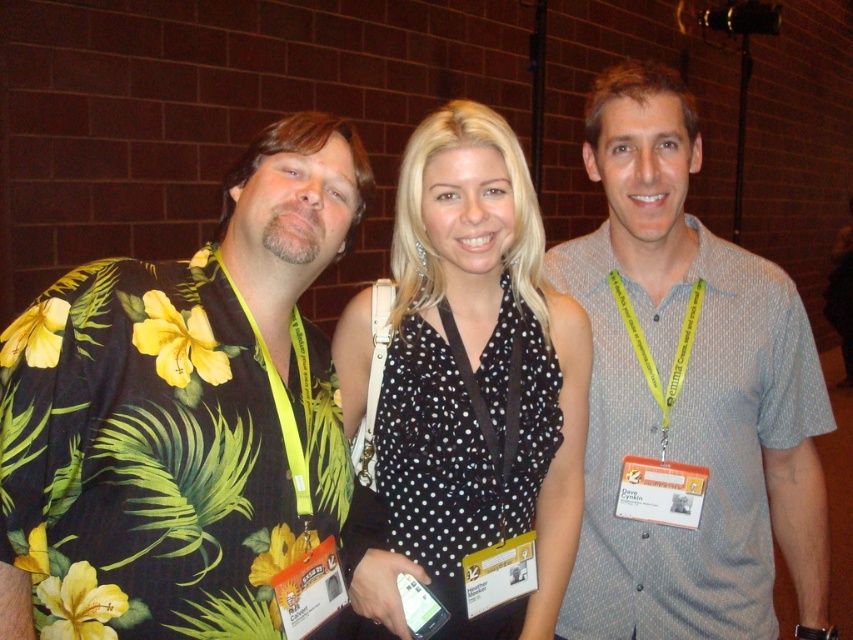
Looking at this image, is black dotted blouse at center above yellow fabric lanyard at left?

Yes.

Looking at this image, measure the distance between point (543, 467) and camera.

Point (543, 467) is 1.55 meters from camera.

You are a GUI agent. You are given a task and a screenshot of the screen. Output one action in this format:
    pyautogui.click(x=<x>, y=<y>)
    Task: Click on the black dotted blouse at center
    The image size is (853, 640).
    Given the screenshot: What is the action you would take?
    pyautogui.click(x=465, y=396)

Where is `black dotted blouse at center`? black dotted blouse at center is located at coordinates tap(465, 396).

Does gray dotted shirt at center have a lesser height compared to yellow fabric lanyard at left?

No, gray dotted shirt at center is not shorter than yellow fabric lanyard at left.

Can you confirm if gray dotted shirt at center is positioned to the right of yellow fabric lanyard at left?

Correct, you'll find gray dotted shirt at center to the right of yellow fabric lanyard at left.

At what (x,y) coordinates should I click in order to perform the action: click on gray dotted shirt at center. Please return your answer as a coordinate pair (x, y). The image size is (853, 640). Looking at the image, I should click on (688, 394).

In the scene shown: Between floral print shirt at left and yellow fabric lanyard at left, which one has less height?

yellow fabric lanyard at left is shorter.

From the picture: Is floral print shirt at left positioned behind yellow fabric lanyard at left?

No, it is not.

Image resolution: width=853 pixels, height=640 pixels. What are the coordinates of `floral print shirt at left` in the screenshot? It's located at (181, 413).